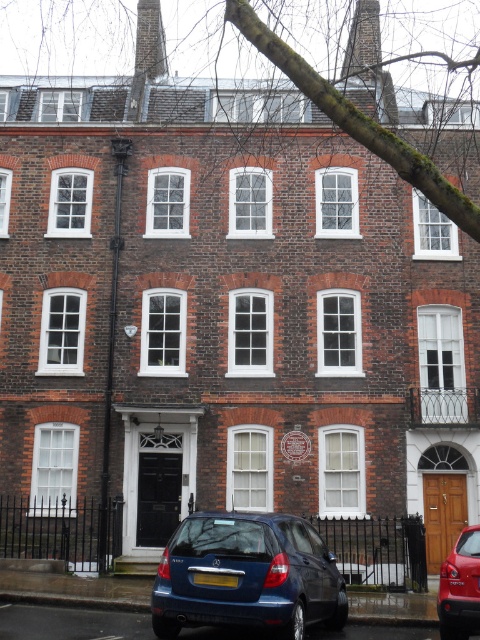
Is glossy metallic hatchback at lower center above metallic blue hatchback at center?

Actually, glossy metallic hatchback at lower center is below metallic blue hatchback at center.

Where is `glossy metallic hatchback at lower center`? The image size is (480, 640). glossy metallic hatchback at lower center is located at coordinates (247, 576).